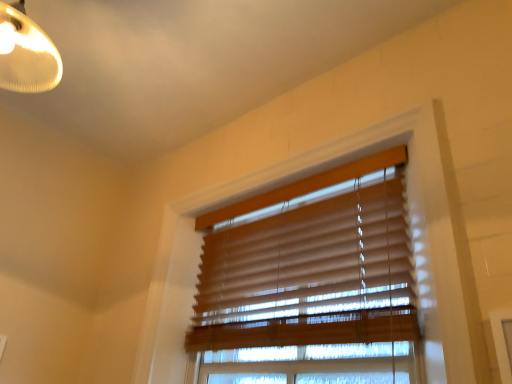
What do you see at coordinates (309, 282) in the screenshot? The width and height of the screenshot is (512, 384). I see `wooden blinds at upper center` at bounding box center [309, 282].

The height and width of the screenshot is (384, 512). What are the coordinates of `wooden blinds at upper center` in the screenshot? It's located at (309, 282).

Where is `wooden blinds at upper center`? This screenshot has height=384, width=512. wooden blinds at upper center is located at coordinates (309, 282).